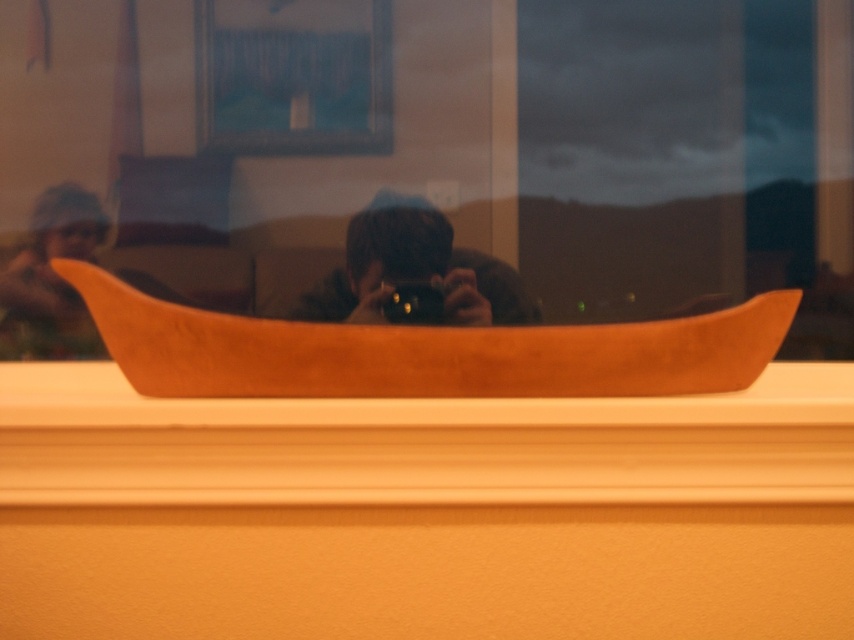
Is transparent glass window at upper center positioned at the back of smooth wood window sill at lower center?

Answer: Yes.

Between transparent glass window at upper center and smooth wood window sill at lower center, which one has less height?

smooth wood window sill at lower center is shorter.

The height and width of the screenshot is (640, 854). Find the location of `transparent glass window at upper center`. transparent glass window at upper center is located at coordinates tap(427, 157).

Can you confirm if transparent glass window at upper center is shorter than matte black camera at center?

A: Incorrect, transparent glass window at upper center's height does not fall short of matte black camera at center's.

How far apart are transparent glass window at upper center and matte black camera at center?

The distance of transparent glass window at upper center from matte black camera at center is 12.20 centimeters.

Image resolution: width=854 pixels, height=640 pixels. In order to click on transparent glass window at upper center in this screenshot , I will do `click(427, 157)`.

Can you confirm if transparent glass window at upper center is positioned to the left of matte brown wooden boat at left?

No, transparent glass window at upper center is not to the left of matte brown wooden boat at left.

Is point (303, 289) farther from viewer compared to point (18, 273)?

No, (303, 289) is closer to viewer.

Locate an element on the screen. The height and width of the screenshot is (640, 854). transparent glass window at upper center is located at coordinates (427, 157).